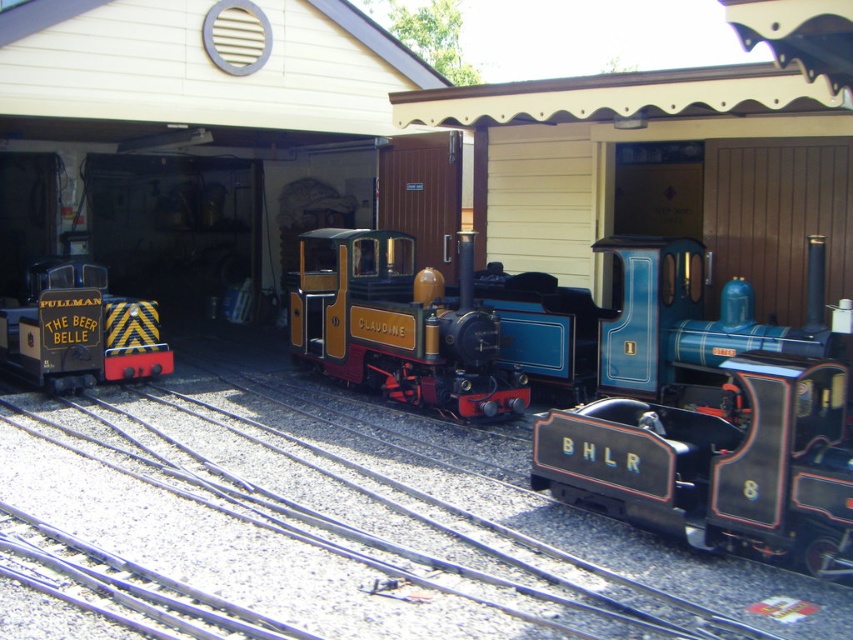
You are a model train enthusiast standing in front of the miniature railway scene. You see the black polished wood train at center and the gold polished metal claudine at center. Which one is positioned to the right?

The black polished wood train at center is positioned to the right of the gold polished metal claudine at center.

You are a model railway enthusiast examining the miniature railway scene. You notice the gold polished metal claudine at center and the yellow and black striped train at left. Which of these two objects is positioned lower in the image?

The gold polished metal claudine at center is positioned lower than the yellow and black striped train at left in the image.

You are a model train enthusiast who wants to place the black polished wood train at center and the yellow and black striped train at left on a shelf. The shelf has limited space. Based on the scene, which train takes up more space?

The yellow and black striped train at left takes up more space than the black polished wood train at center, as the black polished wood train at center occupies less space according to the description.